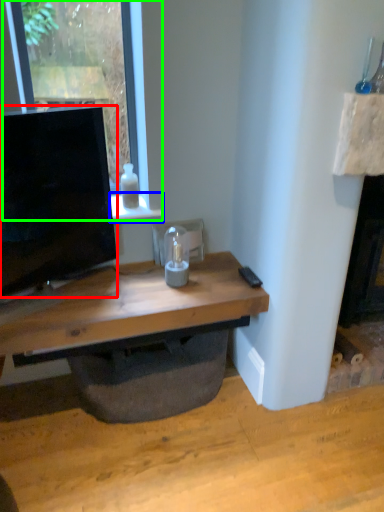
Question: Based on their relative distances, which object is farther from television (highlighted by a red box)? Choose from window sill (highlighted by a blue box) and window (highlighted by a green box).

Choices:
 (A) window sill
 (B) window

Answer: (B)